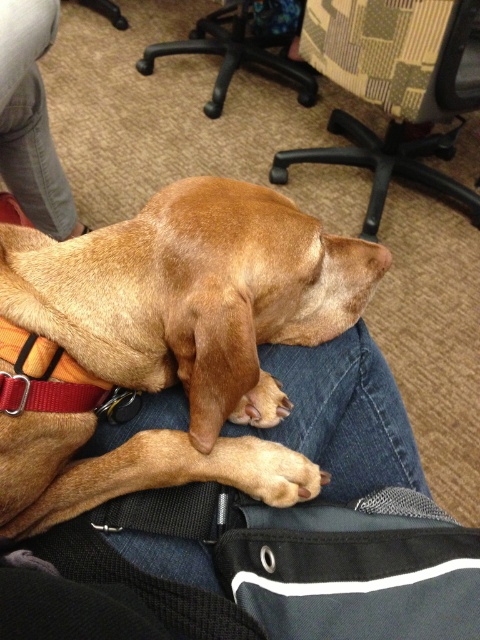
What is the 2D coordinate of the patterned fabric chair at upper center in the image?

The patterned fabric chair at upper center is located at the 2D coordinate point of (393, 88).

You are sitting in an office and want to move from your current position to the door located behind the black plastic chair at upper center. Can you walk directly behind the patterned fabric chair at upper center to reach the door?

The patterned fabric chair at upper center is in front of the black plastic chair at upper center, so walking directly behind the patterned fabric chair at upper center would place you behind the black plastic chair at upper center as well, allowing you to reach the door.

You are standing 1.5 meters away from the image. There is a point at coordinates point (10, 150) in the image. Can you reach that point without moving closer than 1.39 meters to the image?

The distance of point (10, 150) from viewer is 1.39 meters, so if you are standing 1.5 meters away from the image, you can reach that point without moving closer than 1.39 meters to the image.